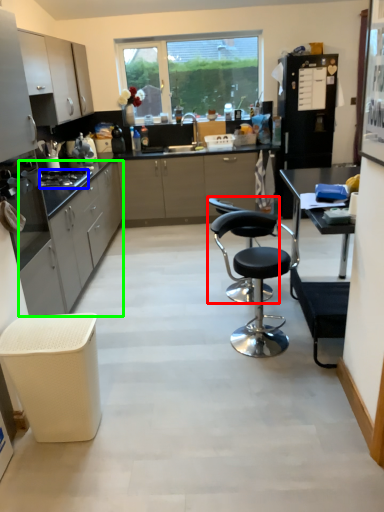
Question: Which is farther away from chair (highlighted by a red box)? gas stove (highlighted by a blue box) or cabinetry (highlighted by a green box)?

Choices:
 (A) gas stove
 (B) cabinetry

Answer: (A)